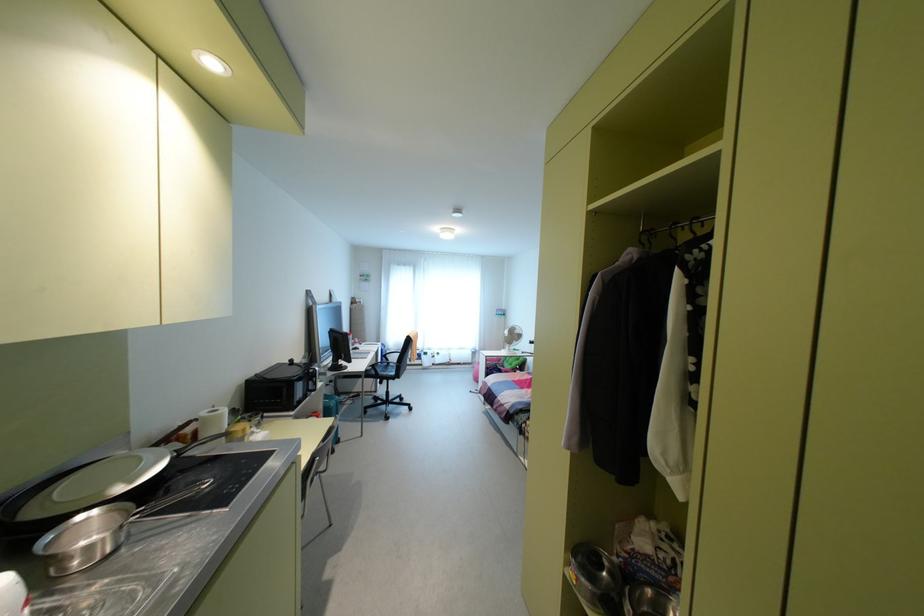
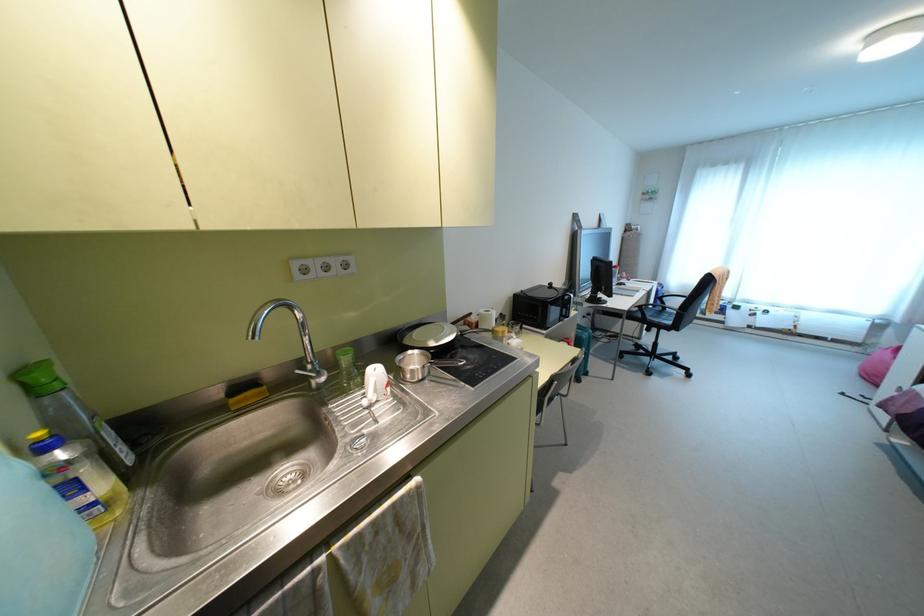
Locate, in the second image, the point that corresponds to point 238,426 in the first image.

(500, 328)